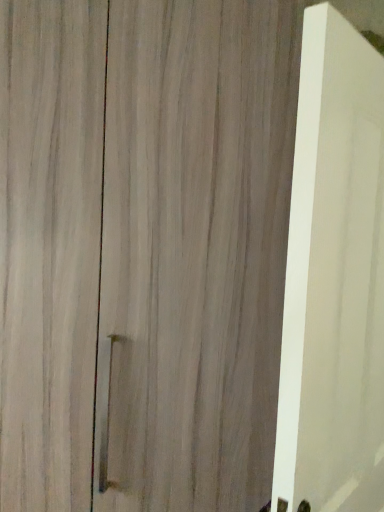
Locate an element on the screen. white matte door at right is located at coordinates (334, 278).

What do you see at coordinates (334, 278) in the screenshot? The width and height of the screenshot is (384, 512). I see `white matte door at right` at bounding box center [334, 278].

What are the coordinates of `white matte door at right` in the screenshot? It's located at (334, 278).